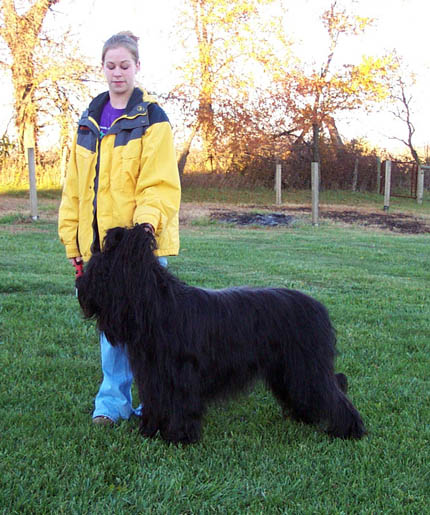
Identify the location of shoe. (101, 420).